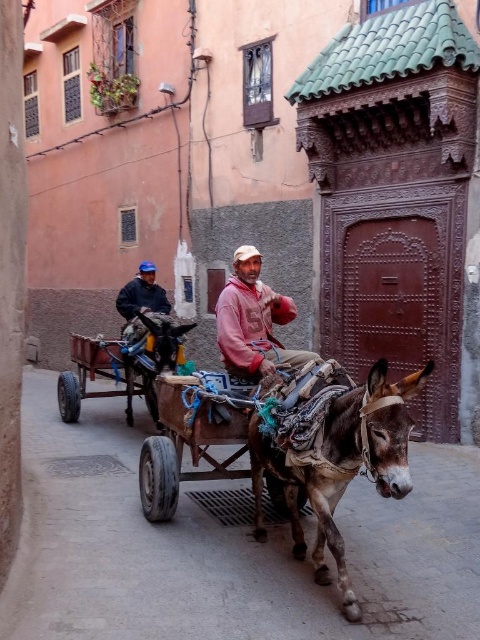
Looking at this image, you are a delivery person who needs to cross the street from the donkey cart to the other side. The street is 7.28 meters wide. Your delivery vehicle can only handle paths narrower than 8 meters. Can you safely cross the street using the path between the two points marked as point [175,356]?

The path between the two points marked as point [175,356] is 7.28 meters wide. Since your delivery vehicle can handle paths narrower than 8 meters, you can safely cross the street using this path.

You are standing at the point with coordinates point (76, 413) and want to walk to the point with coordinates point (288, 445). Which direction should you move to reach your destination?

You should move forward because point (288, 445) is in front of point (76, 413).